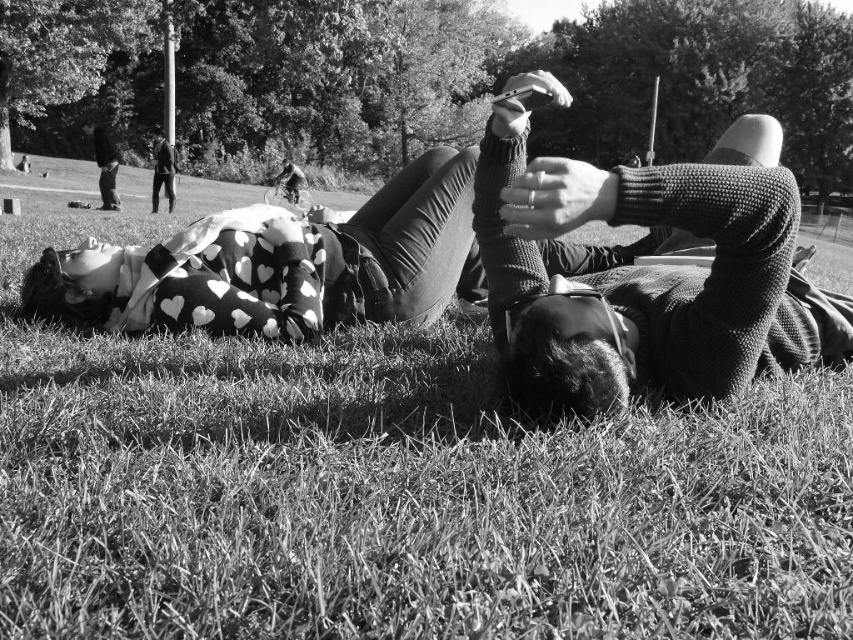
Is knitted sweater at center to the right of dark gray suit at upper left from the viewer's perspective?

Indeed, knitted sweater at center is positioned on the right side of dark gray suit at upper left.

Does knitted sweater at center lie in front of dark gray suit at upper left?

Yes, knitted sweater at center is closer to the viewer.

Does point (677, 321) come closer to viewer compared to point (166, 168)?

Yes, point (677, 321) is closer to viewer.

I want to click on knitted sweater at center, so click(648, 275).